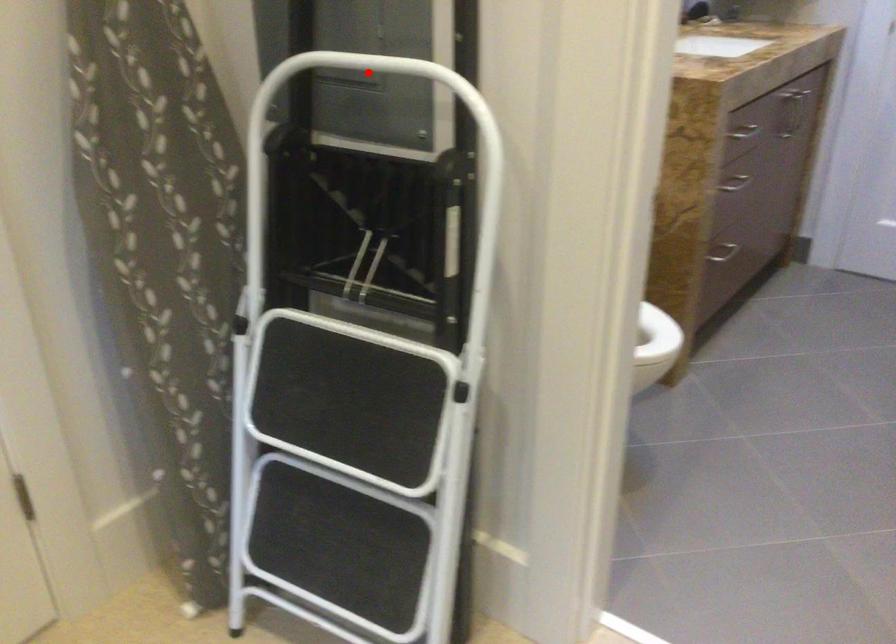
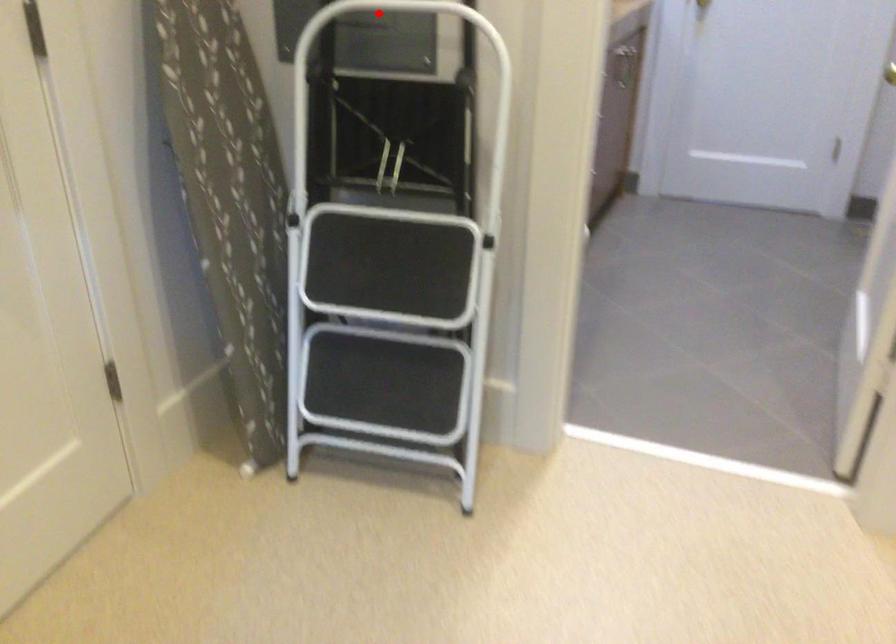
I am providing you with two images of the same scene from different viewpoints. A red point is marked on the first image and another point is marked on the second image. Is the marked point in image1 the same physical position as the marked point in image2?

Yes